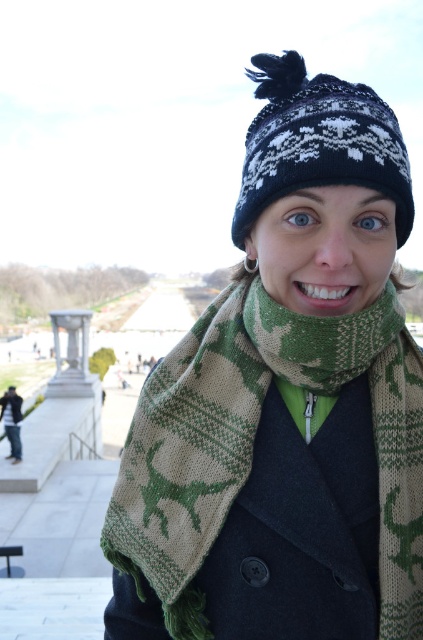
You are a fashion designer observing the person in the image. Which item is positioned lower on their body between the green knitted scarf at center and the black knitted hat at upper center?

The green knitted scarf at center is located below the black knitted hat at upper center, so the green knitted scarf at center is positioned lower on their body.

You are a photographer trying to capture the green knitted scarf at center and the matte black coat at upper center in a single shot. Which object should you focus on first to ensure both are in sharp focus?

You should focus on the matte black coat at upper center first because it is farther away from the viewer than the green knitted scarf at center, ensuring depth of field covers both.

You are a photographer standing 1.5 meters away from the camera. You want to take a closeup shot of the green knitted scarf at center. Is the scarf within your reach to adjust its position?

The green knitted scarf at center is 2.04 meters away from the camera. Since you are standing 1.5 meters away from the camera, the total distance between you and the scarf would be 0.54 meters. Therefore, you can easily reach out to adjust the position of the green knitted scarf at center.